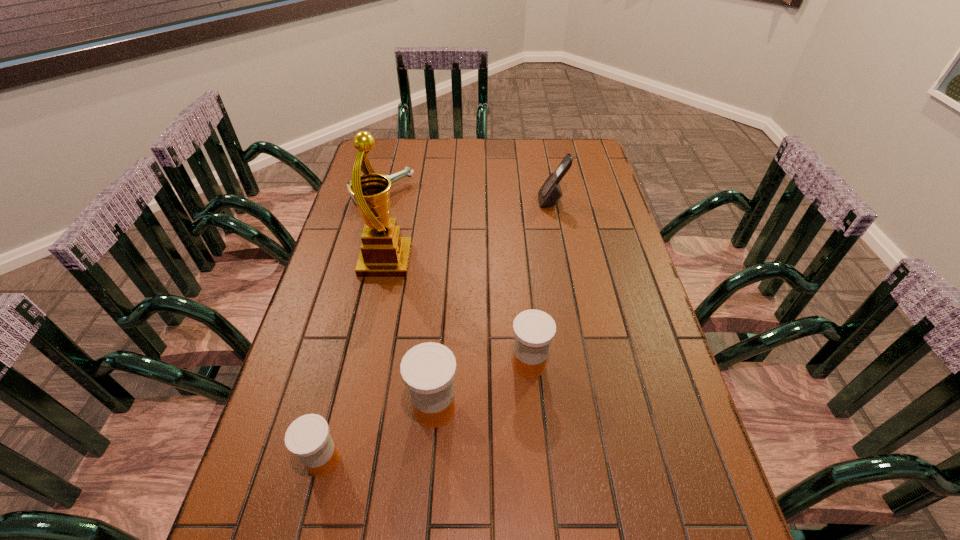
Identify the location of vacant space located on the front-facing side of the award. Image resolution: width=960 pixels, height=540 pixels. (426, 261).

The width and height of the screenshot is (960, 540). I want to click on object present at the near edge, so click(308, 437).

Where is `medicine located at the left edge`? medicine located at the left edge is located at coordinates (308, 437).

Find the location of a particular element. This screenshot has width=960, height=540. bottle that is at the left edge is located at coordinates (408, 171).

Locate an element on the screen. award at the left edge is located at coordinates (384, 253).

Locate an element on the screen. This screenshot has height=540, width=960. object that is at the right edge is located at coordinates (550, 193).

The image size is (960, 540). What are the coordinates of `object at the near left corner` in the screenshot? It's located at (308, 437).

Where is `vacant space at the far edge of the desktop`? The height and width of the screenshot is (540, 960). vacant space at the far edge of the desktop is located at coordinates (406, 153).

Locate an element on the screen. free space at the near edge is located at coordinates (380, 511).

Identify the location of vacant position at the left edge of the desktop. (323, 336).